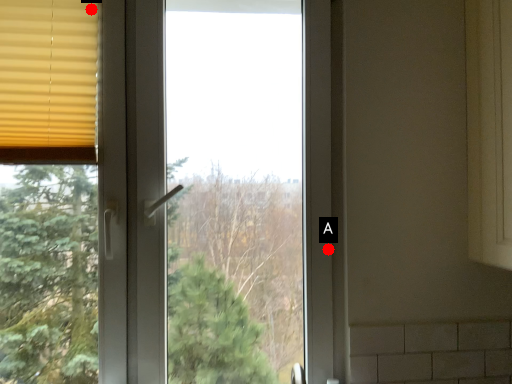
Question: Two points are circled on the image, labeled by A and B beside each circle. Which point is further to the camera?

Choices:
 (A) A is further
 (B) B is further

Answer: (A)